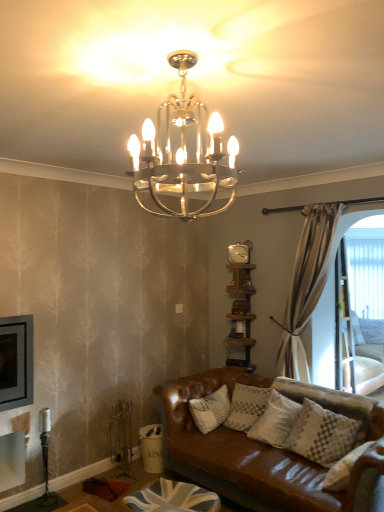
Question: Is metallic chandelier at upper center at the right side of brown wooden shelf at right?

Choices:
 (A) yes
 (B) no

Answer: (B)

Question: Is metallic chandelier at upper center oriented away from brown wooden shelf at right?

Choices:
 (A) yes
 (B) no

Answer: (B)

Question: Is metallic chandelier at upper center positioned in front of brown wooden shelf at right?

Choices:
 (A) yes
 (B) no

Answer: (A)

Question: Is metallic chandelier at upper center placed right next to brown wooden shelf at right?

Choices:
 (A) no
 (B) yes

Answer: (A)

Question: Considering the relative sizes of metallic chandelier at upper center and brown wooden shelf at right in the image provided, is metallic chandelier at upper center thinner than brown wooden shelf at right?

Choices:
 (A) yes
 (B) no

Answer: (B)

Question: From a real-world perspective, is metallic chandelier at upper center located higher than brown wooden shelf at right?

Choices:
 (A) yes
 (B) no

Answer: (A)

Question: Is white mesh screen at right wider than union jack fabric footrest at lower center?

Choices:
 (A) yes
 (B) no

Answer: (B)

Question: Is white mesh screen at right in front of union jack fabric footrest at lower center?

Choices:
 (A) no
 (B) yes

Answer: (A)

Question: Is white mesh screen at right further to the viewer compared to union jack fabric footrest at lower center?

Choices:
 (A) no
 (B) yes

Answer: (B)

Question: Is union jack fabric footrest at lower center at the back of white mesh screen at right?

Choices:
 (A) yes
 (B) no

Answer: (B)

Question: Can you confirm if white mesh screen at right is shorter than union jack fabric footrest at lower center?

Choices:
 (A) yes
 (B) no

Answer: (B)

Question: Can you confirm if white mesh screen at right is bigger than union jack fabric footrest at lower center?

Choices:
 (A) no
 (B) yes

Answer: (A)

Question: Is the position of white mesh screen at right less distant than that of metallic chandelier at upper center?

Choices:
 (A) no
 (B) yes

Answer: (A)